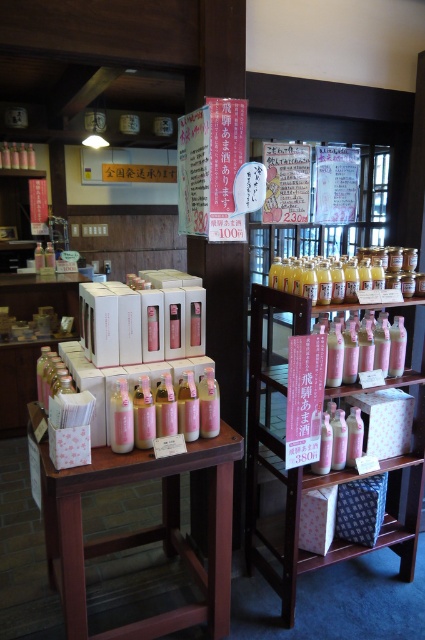
Question: Can you confirm if wooden table at center is bigger than pink matte bottles at center right?

Choices:
 (A) yes
 (B) no

Answer: (B)

Question: Which of the following is the closest to the observer?

Choices:
 (A) (388, 525)
 (B) (115, 461)

Answer: (B)

Question: Does wooden table at center appear on the left side of pink matte bottles at center right?

Choices:
 (A) no
 (B) yes

Answer: (B)

Question: Which point appears closest to the camera in this image?

Choices:
 (A) (300, 570)
 (B) (107, 458)

Answer: (B)

Question: Does wooden table at center appear under pink matte bottles at center right?

Choices:
 (A) yes
 (B) no

Answer: (A)